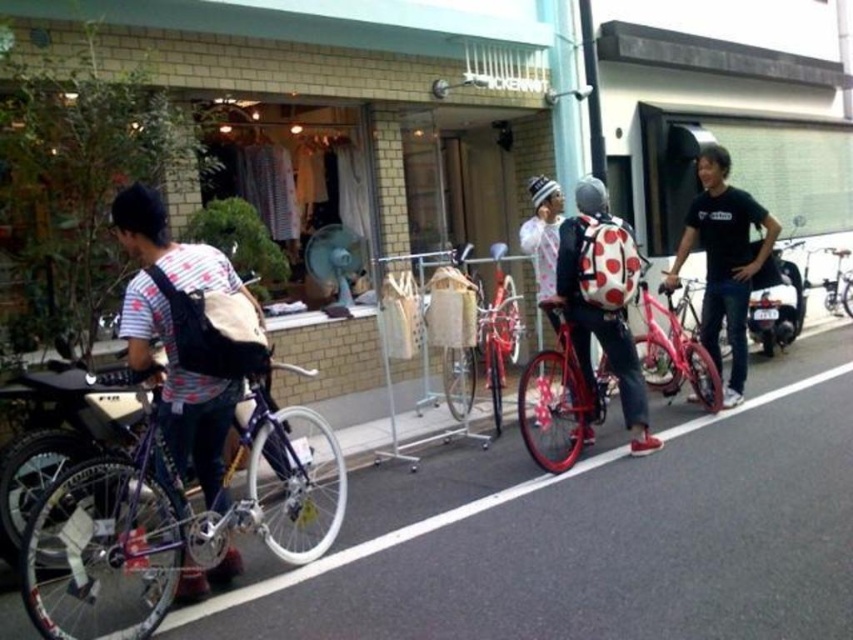
Question: Is black polka dot backpack at right closer to camera compared to metallic silver bicycle at center?

Choices:
 (A) no
 (B) yes

Answer: (B)

Question: From the image, what is the correct spatial relationship of red matte bicycle at center in relation to metallic silver bicycle at center?

Choices:
 (A) above
 (B) below

Answer: (B)

Question: Which of these objects is positioned farthest from the polka dot backpack at center?

Choices:
 (A) shiny purple bicycle at center
 (B) metallic pavement at center
 (C) matte black backpack at left

Answer: (C)

Question: Which is farther from the gray fabric helmet at center?

Choices:
 (A) white polka dot backpack at center
 (B) polka dot backpack at center
 (C) black polka dot backpack at right

Answer: (C)

Question: Which object is the closest to the matte black backpack at left?

Choices:
 (A) black polka dot backpack at right
 (B) shiny purple bicycle at center
 (C) red matte bicycle at center

Answer: (B)

Question: Is shiny purple bicycle at center thinner than gray fabric helmet at center?

Choices:
 (A) no
 (B) yes

Answer: (A)